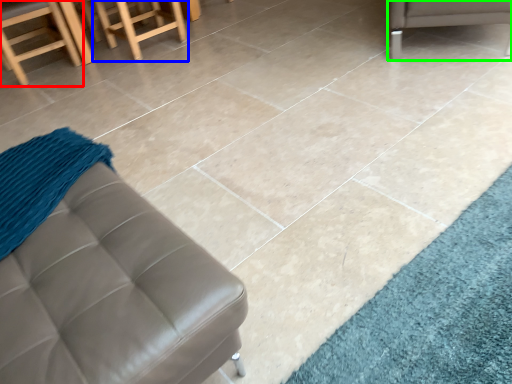
Question: Which is farther away from chair (highlighted by a red box)? stool (highlighted by a blue box) or furniture (highlighted by a green box)?

Choices:
 (A) stool
 (B) furniture

Answer: (B)